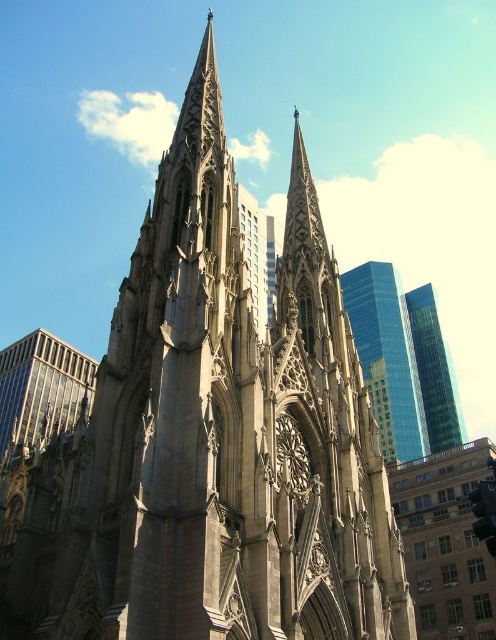
Can you confirm if glassy blue skyscraper at upper right is smaller than green glass skyscraper at upper right?

No, glassy blue skyscraper at upper right is not smaller than green glass skyscraper at upper right.

Based on the photo, is glassy blue skyscraper at upper right to the left of green glass skyscraper at upper right from the viewer's perspective?

Yes, glassy blue skyscraper at upper right is to the left of green glass skyscraper at upper right.

Between point (344, 276) and point (426, 310), which one is positioned in front?

Point (344, 276) is more forward.

The image size is (496, 640). I want to click on glassy blue skyscraper at upper right, so click(386, 358).

Who is shorter, glassy blue skyscraper at upper right or glassy reflective skyscraper at left?

With less height is glassy reflective skyscraper at left.

At what (x,y) coordinates should I click in order to perform the action: click on glassy blue skyscraper at upper right. Please return your answer as a coordinate pair (x, y). The image size is (496, 640). Looking at the image, I should click on (386, 358).

Locate an element on the screen. The width and height of the screenshot is (496, 640). glassy blue skyscraper at upper right is located at coordinates (386, 358).

Is point (7, 378) positioned before point (432, 328)?

Yes, point (7, 378) is in front of point (432, 328).

What do you see at coordinates (41, 388) in the screenshot? The height and width of the screenshot is (640, 496). I see `glassy reflective skyscraper at left` at bounding box center [41, 388].

Find the location of a particular element. glassy reflective skyscraper at left is located at coordinates (41, 388).